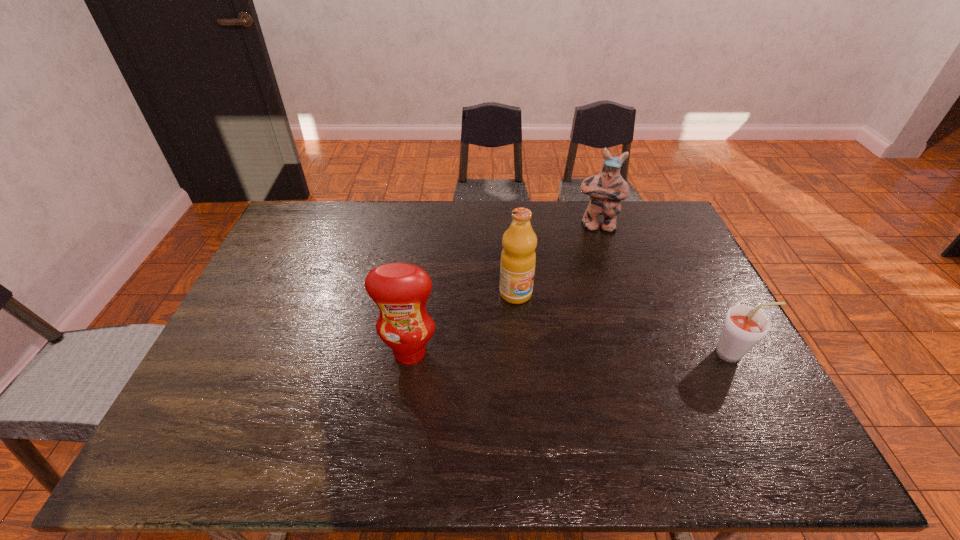
The width and height of the screenshot is (960, 540). Find the location of `vacant space on the desktop that is between the leftmost object and the shortest object and is positioned on the front-facing side of the figurine`. vacant space on the desktop that is between the leftmost object and the shortest object and is positioned on the front-facing side of the figurine is located at coordinates (606, 353).

At what (x,y) coordinates should I click in order to perform the action: click on free spot on the desktop that is between the leftmost object and the root beer and is positioned on the front label of the second object from left to right. Please return your answer as a coordinate pair (x, y). Looking at the image, I should click on (569, 353).